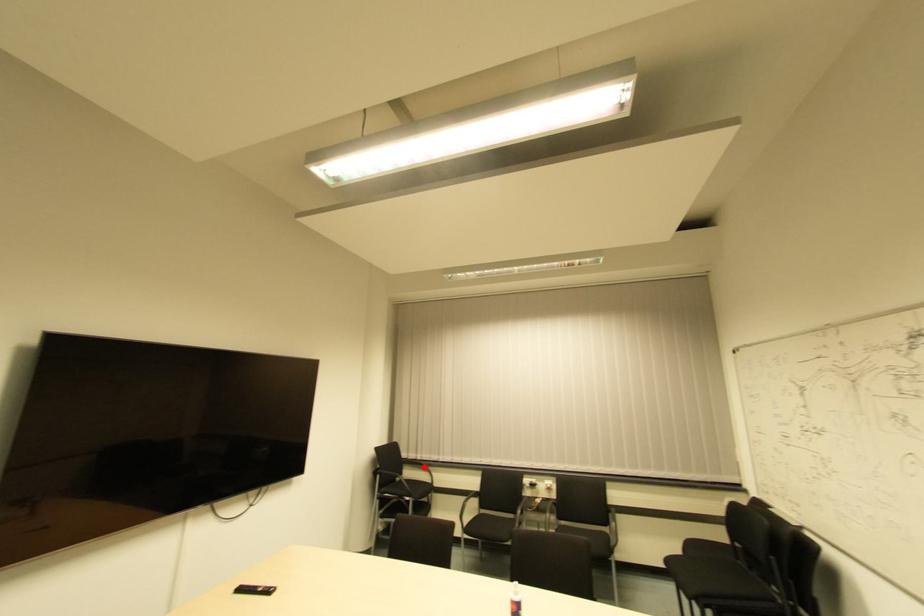
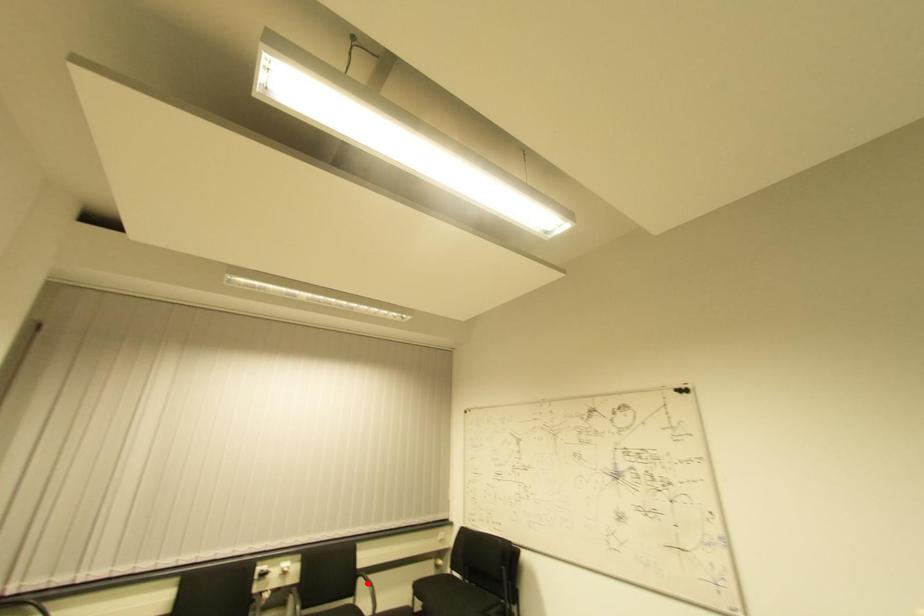
I am providing you with two images of the same scene from different viewpoints. A red point is marked on the first image and another point is marked on the second image. Do the highlighted points in image1 and image2 indicate the same real-world spot?

No